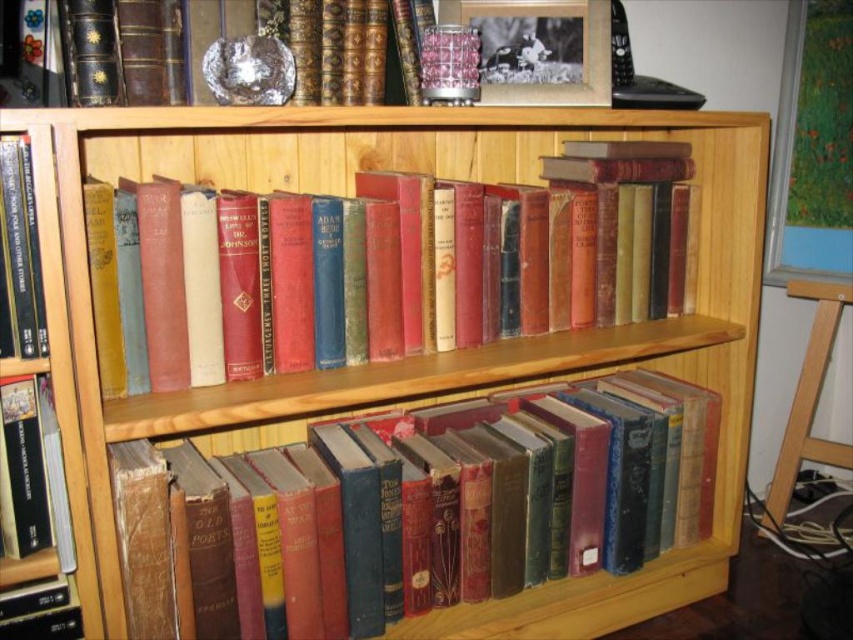
Question: Which of these objects is positioned closest to the matte hardcover books at center?

Choices:
 (A) vintage leather book at center
 (B) matte black book at left

Answer: (A)

Question: Can you confirm if matte black book at left is bigger than leather-bound book at upper left?

Choices:
 (A) no
 (B) yes

Answer: (A)

Question: Which object appears closest to the camera in this image?

Choices:
 (A) leather-bound book at upper left
 (B) matte hardcover books at center

Answer: (A)

Question: Among these objects, which one is nearest to the camera?

Choices:
 (A) leather-bound book at upper left
 (B) vintage leather book at center
 (C) hardcover book at left

Answer: (C)

Question: Is matte black book at left in front of leather-bound book at upper left?

Choices:
 (A) yes
 (B) no

Answer: (A)

Question: Is vintage leather book at center above matte black book at left?

Choices:
 (A) no
 (B) yes

Answer: (A)